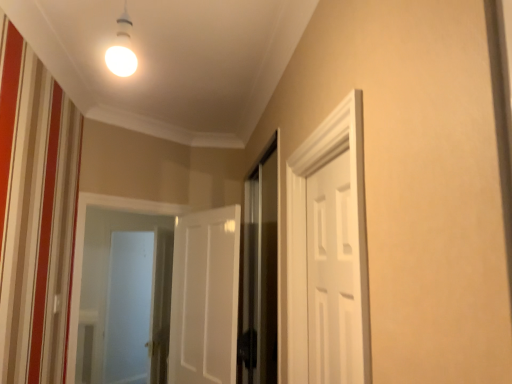
Question: Is white matte door at right, positioned as the 2th door in left-to-right order, located outside transparent glass screen door at center, which ranks as the 1th screen door in front-to-back order?

Choices:
 (A) yes
 (B) no

Answer: (A)

Question: Can you confirm if white matte door at right, positioned as the 2th door in left-to-right order, is smaller than transparent glass screen door at center, acting as the second screen door starting from the back?

Choices:
 (A) yes
 (B) no

Answer: (A)

Question: Is white matte door at right, positioned as the 2th door in left-to-right order, looking in the opposite direction of transparent glass screen door at center, acting as the second screen door starting from the left?

Choices:
 (A) no
 (B) yes

Answer: (A)

Question: Can you confirm if white matte door at right, positioned as the 2th door in left-to-right order, is taller than transparent glass screen door at center, which ranks as the 1th screen door in front-to-back order?

Choices:
 (A) yes
 (B) no

Answer: (B)

Question: Is white matte door at right, which ranks as the 2th door in back-to-front order, to the left of transparent glass screen door at center, acting as the second screen door starting from the back, from the viewer's perspective?

Choices:
 (A) yes
 (B) no

Answer: (B)

Question: Can you confirm if white matte door at right, positioned as the 2th door in left-to-right order, is shorter than transparent glass screen door at center, which ranks as the 1th screen door in front-to-back order?

Choices:
 (A) yes
 (B) no

Answer: (A)

Question: From a real-world perspective, does transparent glass screen door at center, which ranks as the 1th screen door in front-to-back order, sit lower than frosted glass screen door at left, acting as the first screen door starting from the back?

Choices:
 (A) no
 (B) yes

Answer: (A)

Question: Is transparent glass screen door at center, acting as the second screen door starting from the left, at the left side of frosted glass screen door at left, the 2th screen door viewed from the right?

Choices:
 (A) no
 (B) yes

Answer: (A)

Question: Is transparent glass screen door at center, acting as the second screen door starting from the left, not close to frosted glass screen door at left, the 2th screen door viewed from the right?

Choices:
 (A) no
 (B) yes

Answer: (B)

Question: Considering the relative positions of transparent glass screen door at center, the 1th screen door viewed from the right, and frosted glass screen door at left, the 2th screen door viewed from the front, in the image provided, is transparent glass screen door at center, the 1th screen door viewed from the right, to the right of frosted glass screen door at left, the 2th screen door viewed from the front, from the viewer's perspective?

Choices:
 (A) yes
 (B) no

Answer: (A)

Question: Is transparent glass screen door at center, the 1th screen door viewed from the right, wider than frosted glass screen door at left, the 2th screen door viewed from the front?

Choices:
 (A) no
 (B) yes

Answer: (A)

Question: From the image's perspective, is transparent glass screen door at center, the 1th screen door viewed from the right, below frosted glass screen door at left, the first screen door viewed from the left?

Choices:
 (A) yes
 (B) no

Answer: (B)

Question: Is white matte door at center, which is the first door in back-to-front order, positioned in front of white matte door at right, acting as the first door starting from the front?

Choices:
 (A) no
 (B) yes

Answer: (A)